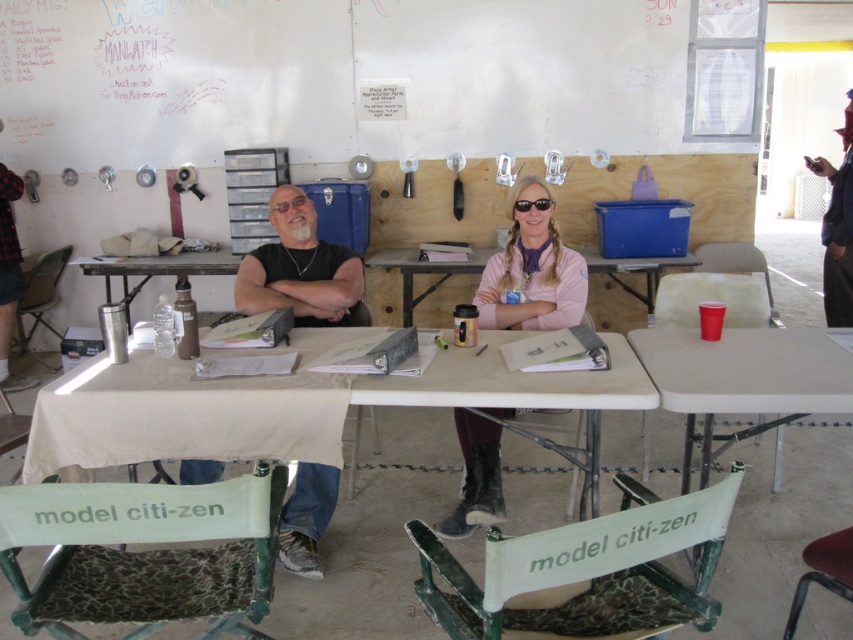
Does red plastic cup at right have a smaller size compared to pink fleece jacket at center?

Incorrect, red plastic cup at right is not smaller in size than pink fleece jacket at center.

Between point (741, 372) and point (560, 280), which one is positioned in front?

Point (741, 372) is in front.

The image size is (853, 640). I want to click on red plastic cup at right, so click(741, 380).

Is white plastic table at center bigger than sunglasses at center?

Indeed, white plastic table at center has a larger size compared to sunglasses at center.

Is white plastic table at center thinner than sunglasses at center?

Incorrect, white plastic table at center's width is not less than sunglasses at center's.

Find the location of a particular element. The width and height of the screenshot is (853, 640). white plastic table at center is located at coordinates (283, 406).

Image resolution: width=853 pixels, height=640 pixels. Identify the location of white plastic table at center. (283, 406).

Consider the image. Does red plastic cup at right have a greater height compared to pink fabric table at center?

Indeed, red plastic cup at right has a greater height compared to pink fabric table at center.

You are a GUI agent. You are given a task and a screenshot of the screen. Output one action in this format:
    pyautogui.click(x=<x>, y=<y>)
    Task: Click on the red plastic cup at right
    The image size is (853, 640).
    Given the screenshot: What is the action you would take?
    pyautogui.click(x=741, y=380)